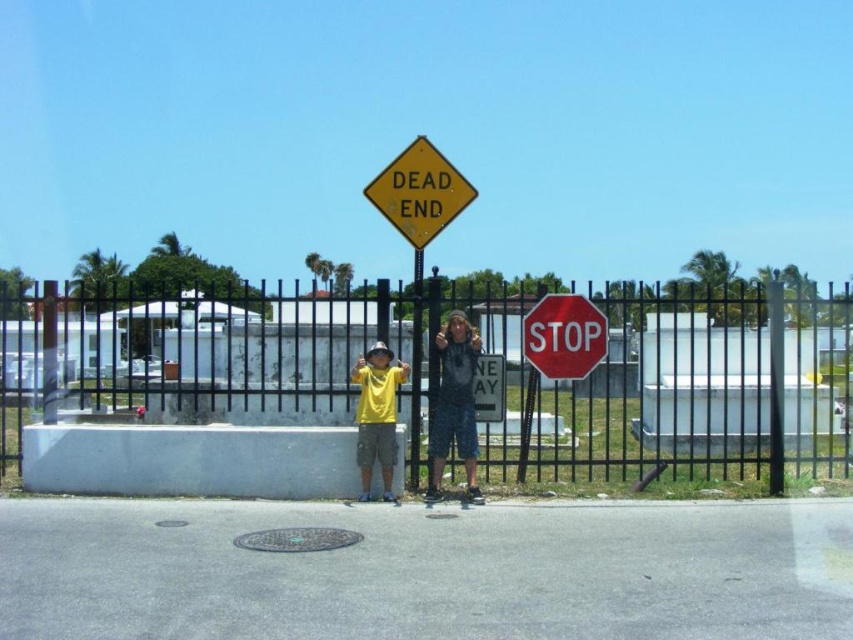
You are a photographer taking a picture of the denim shorts at center and the yellow matte shirt at center. Which one will appear closer to the camera in the photo?

The denim shorts at center will appear closer to the camera because the yellow matte shirt at center is behind it.